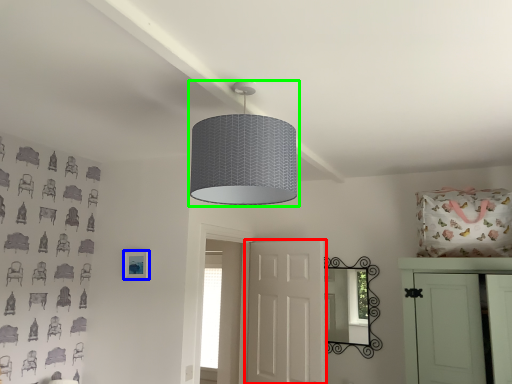
Question: Which is nearer to the door (highlighted by a red box)? picture frame (highlighted by a blue box) or lamp (highlighted by a green box).

Choices:
 (A) picture frame
 (B) lamp

Answer: (A)